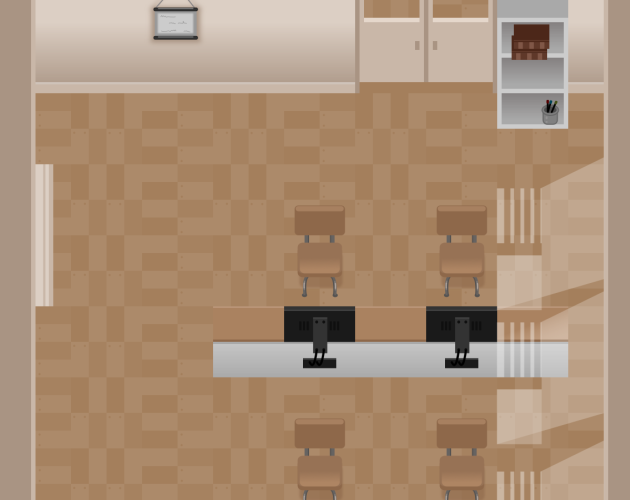
Locate an element on the screen. The image size is (630, 500). wood parquet style floor is located at coordinates (205, 234).